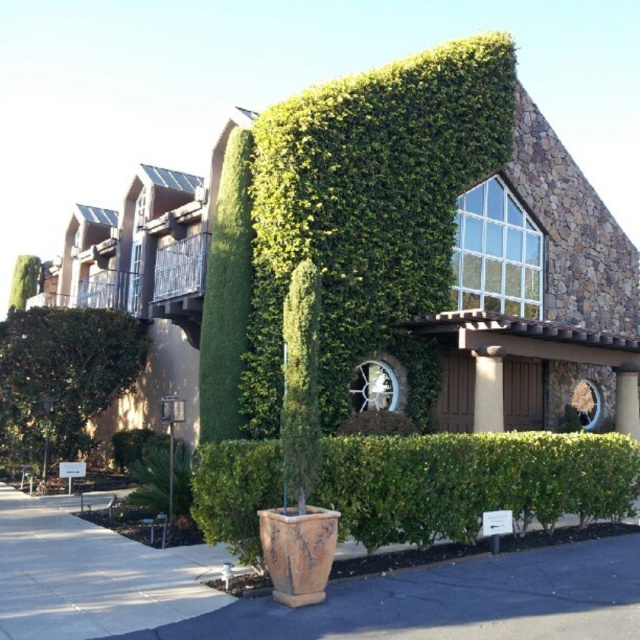
Question: Does green leafy hedge at lower center appear over green leafy bush at lower left?

Choices:
 (A) yes
 (B) no

Answer: (B)

Question: Among these objects, which one is farthest from the camera?

Choices:
 (A) green leafy hedge at lower center
 (B) green leafy bush at lower left

Answer: (B)

Question: Which point appears farthest from the camera in this image?

Choices:
 (A) (435, 460)
 (B) (81, 333)

Answer: (B)

Question: Is green leafy hedge at lower center positioned behind green leafy bush at lower left?

Choices:
 (A) no
 (B) yes

Answer: (A)

Question: Is green leafy hedge at lower center to the left of green leafy bush at lower left from the viewer's perspective?

Choices:
 (A) no
 (B) yes

Answer: (A)

Question: Which point is farther from the camera taking this photo?

Choices:
 (A) (148, 340)
 (B) (220, 522)

Answer: (A)